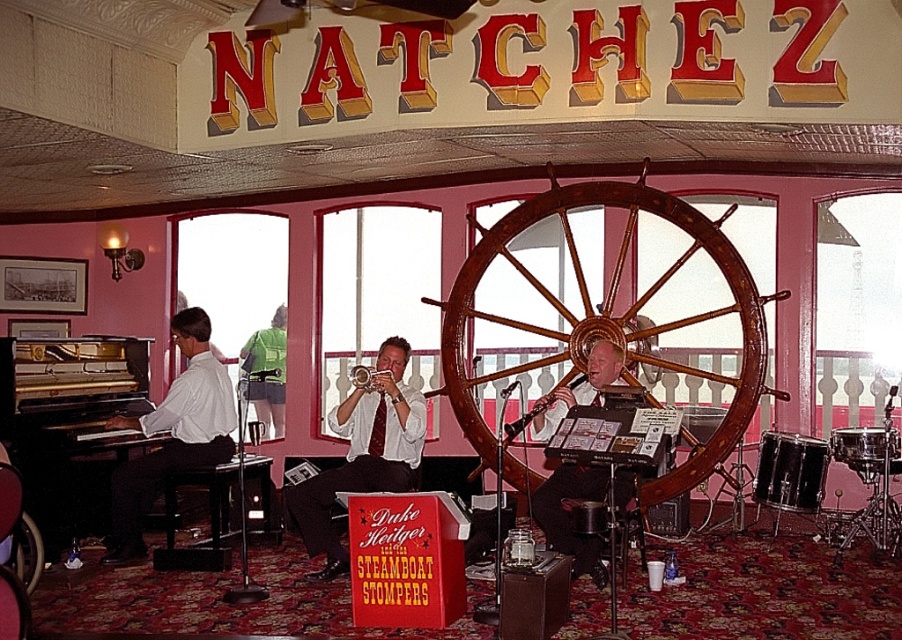
Looking at this image, can you confirm if white satin trumpet at center is positioned to the right of green fabric shirt at left?

Yes, white satin trumpet at center is to the right of green fabric shirt at left.

Can you confirm if white satin trumpet at center is smaller than green fabric shirt at left?

No, white satin trumpet at center is not smaller than green fabric shirt at left.

Find the location of a particular element. white satin trumpet at center is located at coordinates (364, 456).

Between point (219, 396) and point (544, 518), which one is positioned behind?

The point (219, 396) is behind.

Is matte white shirt at left to the left of matte black saxophone at center from the viewer's perspective?

Indeed, matte white shirt at left is positioned on the left side of matte black saxophone at center.

Describe the element at coordinates (172, 435) in the screenshot. I see `matte white shirt at left` at that location.

The width and height of the screenshot is (902, 640). I want to click on matte white shirt at left, so 172,435.

Does point (118, 394) come closer to viewer compared to point (315, 572)?

That is False.

Where is `gold polished piano at left`? Image resolution: width=902 pixels, height=640 pixels. gold polished piano at left is located at coordinates (66, 419).